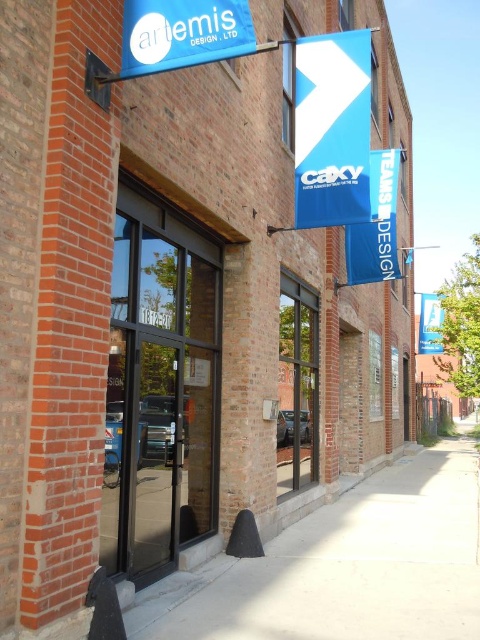
Question: Which of the following is the closest to the observer?

Choices:
 (A) (324, 628)
 (B) (208, 17)

Answer: (B)

Question: Can you confirm if smooth concrete sidewalk at center is positioned below blue matte sign at upper center?

Choices:
 (A) yes
 (B) no

Answer: (A)

Question: Can you confirm if smooth concrete sidewalk at center is positioned below blue matte sign at upper center?

Choices:
 (A) yes
 (B) no

Answer: (A)

Question: Is smooth concrete sidewalk at center in front of blue matte sign at upper center?

Choices:
 (A) yes
 (B) no

Answer: (B)

Question: Which object appears closest to the camera in this image?

Choices:
 (A) blue matte sign at upper center
 (B) smooth concrete sidewalk at center

Answer: (A)